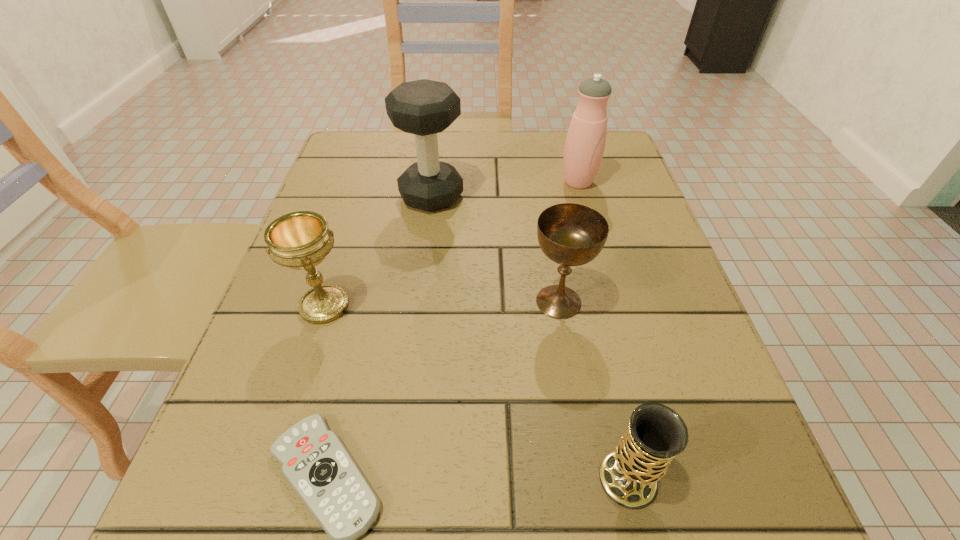
The width and height of the screenshot is (960, 540). What are the coordinates of `dumbbell at the far edge` in the screenshot? It's located at (424, 108).

Where is `object located in the near edge section of the desktop`? The image size is (960, 540). object located in the near edge section of the desktop is located at coordinates [x=629, y=475].

You are a GUI agent. You are given a task and a screenshot of the screen. Output one action in this format:
    pyautogui.click(x=<x>, y=<y>)
    Task: Click on the object present at the left edge
    This screenshot has width=960, height=540.
    Given the screenshot: What is the action you would take?
    pyautogui.click(x=301, y=240)

You are a GUI agent. You are given a task and a screenshot of the screen. Output one action in this format:
    pyautogui.click(x=<x>, y=<y>)
    Task: Click on the thermos bottle positioned at the right edge
    This screenshot has width=960, height=540.
    Given the screenshot: What is the action you would take?
    pyautogui.click(x=585, y=142)

Identify the location of chalice that is at the right edge. (629, 475).

Identify the location of object at the far right corner. The width and height of the screenshot is (960, 540). (585, 142).

The height and width of the screenshot is (540, 960). Find the location of `object at the near right corner`. object at the near right corner is located at coordinates (629, 475).

I want to click on free space at the far edge of the desktop, so click(533, 147).

Identify the location of free location at the near edge of the desktop. Image resolution: width=960 pixels, height=540 pixels. (432, 511).

In the image, there is a desktop. Where is `vacant space at the left edge`? vacant space at the left edge is located at coordinates (269, 363).